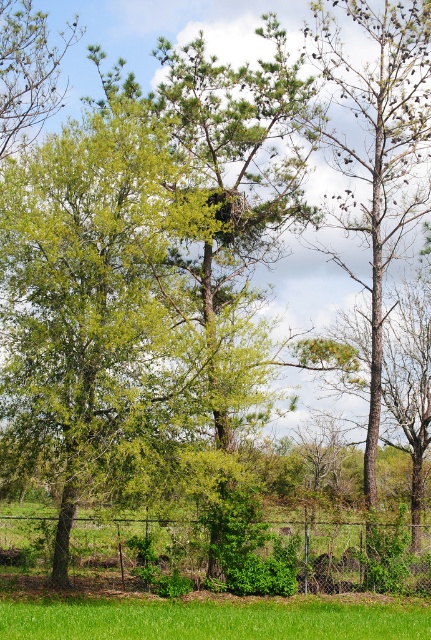
You are standing in the middle of the grassy area and want to walk towards the green leafy tree at upper left. Which direction should you walk relative to the chain link fence at lower center?

You should walk to the left of the chain link fence at lower center because the green leafy tree at upper left is positioned to the left of the chain link fence at lower center.

You are standing at the point marked by the coordinates point (331, 557) in the image. What object are you standing on?

You are standing on the chain link fence at lower center.